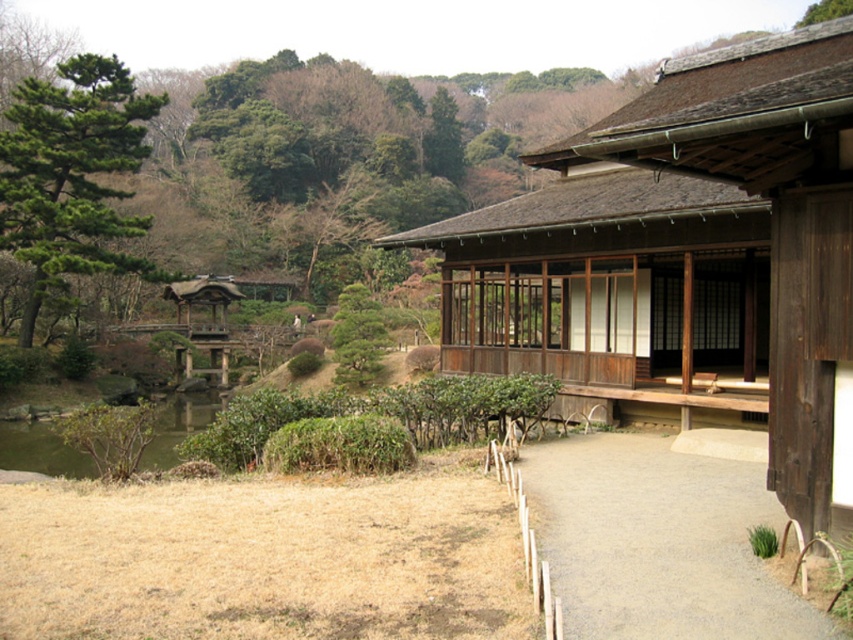
Question: Is green needle-like tree at left to the right of green textured pine tree at center from the viewer's perspective?

Choices:
 (A) no
 (B) yes

Answer: (A)

Question: Where is green needle-like tree at left located in relation to green textured pine tree at center in the image?

Choices:
 (A) below
 (B) above

Answer: (B)

Question: Is the position of green needle-like tree at left less distant than that of green textured pine tree at center?

Choices:
 (A) no
 (B) yes

Answer: (B)

Question: Based on their relative distances, which object is nearer to the green grassy pond at lower left?

Choices:
 (A) gray gravel path at center
 (B) green needle-like tree at left
 (C) green textured pine tree at center

Answer: (C)

Question: Which object is farther from the camera taking this photo?

Choices:
 (A) green textured pine tree at center
 (B) gray gravel path at center
 (C) green grassy pond at lower left

Answer: (A)

Question: Which point is closer to the camera taking this photo?

Choices:
 (A) (686, 621)
 (B) (364, 349)

Answer: (A)